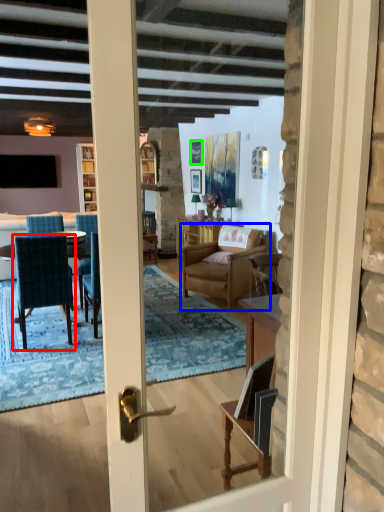
Question: Considering the real-world distances, which object is farthest from chair (highlighted by a red box)? chair (highlighted by a blue box) or picture frame (highlighted by a green box)?

Choices:
 (A) chair
 (B) picture frame

Answer: (B)